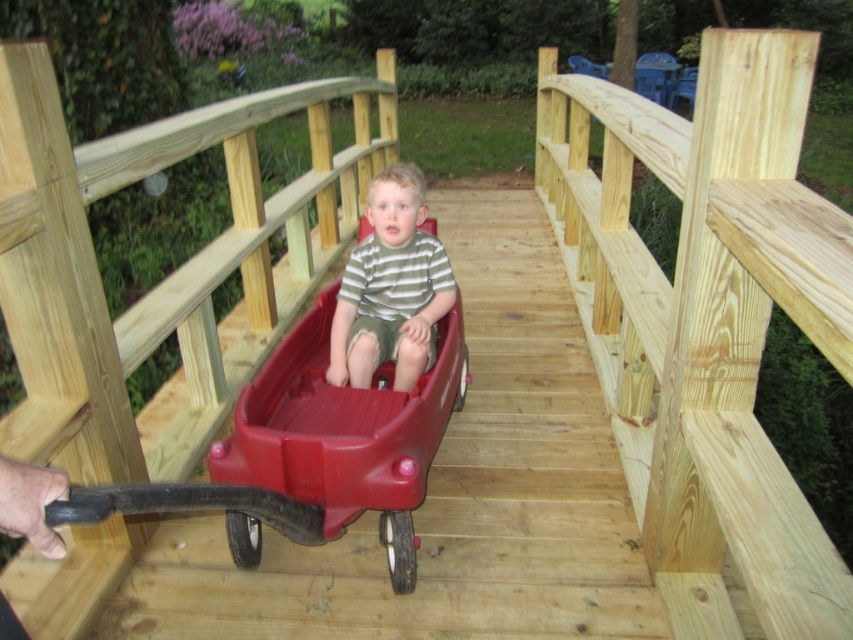
Can you confirm if natural wood rail at center is shorter than striped cotton shirt at center?

No, natural wood rail at center is not shorter than striped cotton shirt at center.

Where is `natural wood rail at center`? This screenshot has height=640, width=853. natural wood rail at center is located at coordinates (706, 321).

Does natural wood rail at center appear under rubberized plastic wagon at center?

No.

You are a GUI agent. You are given a task and a screenshot of the screen. Output one action in this format:
    pyautogui.click(x=<x>, y=<y>)
    Task: Click on the natural wood rail at center
    This screenshot has height=640, width=853.
    Given the screenshot: What is the action you would take?
    pyautogui.click(x=706, y=321)

You are a GUI agent. You are given a task and a screenshot of the screen. Output one action in this format:
    pyautogui.click(x=<x>, y=<y>)
    Task: Click on the natural wood rail at center
    
    Given the screenshot: What is the action you would take?
    pyautogui.click(x=706, y=321)

Who is positioned more to the right, rubberized plastic wagon at center or striped cotton shirt at center?

From the viewer's perspective, striped cotton shirt at center appears more on the right side.

Does point (448, 336) come closer to viewer compared to point (393, 172)?

That is False.

Find the location of a particular element. This screenshot has height=640, width=853. rubberized plastic wagon at center is located at coordinates (312, 451).